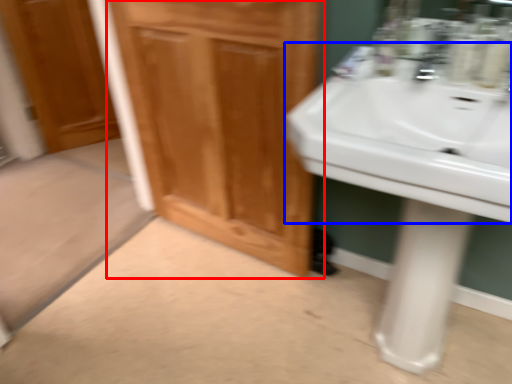
Question: Which object is closer to the camera taking this photo, bathroom cabinet (highlighted by a red box) or sink (highlighted by a blue box)?

Choices:
 (A) bathroom cabinet
 (B) sink

Answer: (B)